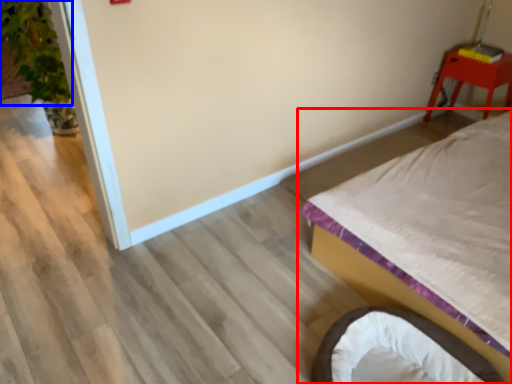
Question: Which object is further to the camera taking this photo, bed (highlighted by a red box) or plant (highlighted by a blue box)?

Choices:
 (A) bed
 (B) plant

Answer: (B)